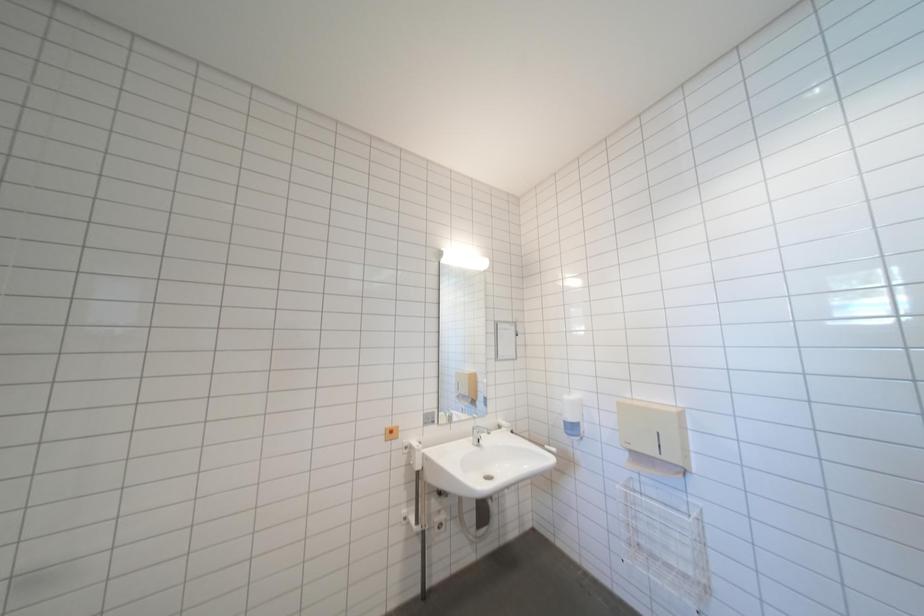
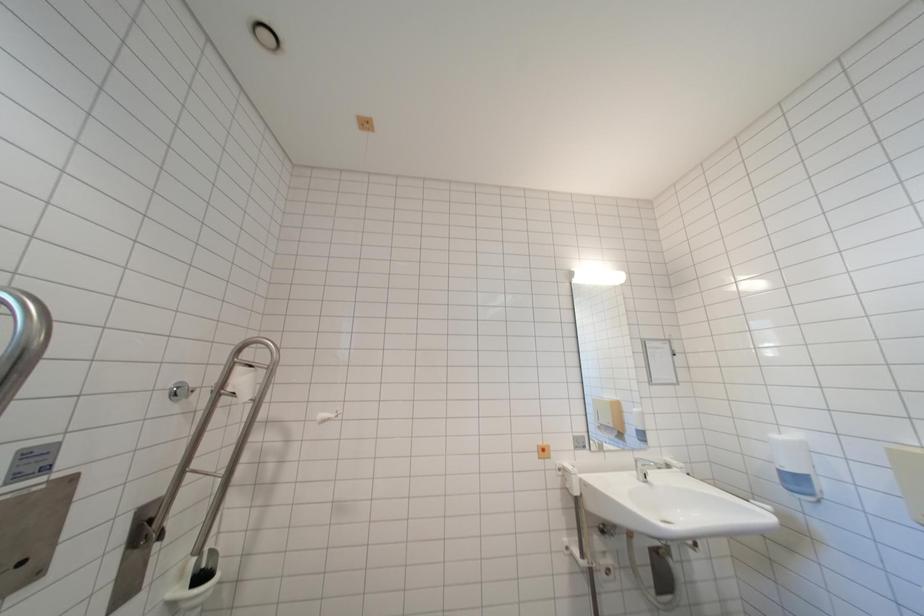
Question: How did the camera likely rotate?

Choices:
 (A) Left
 (B) Right
 (C) Up
 (D) Down

Answer: (A)